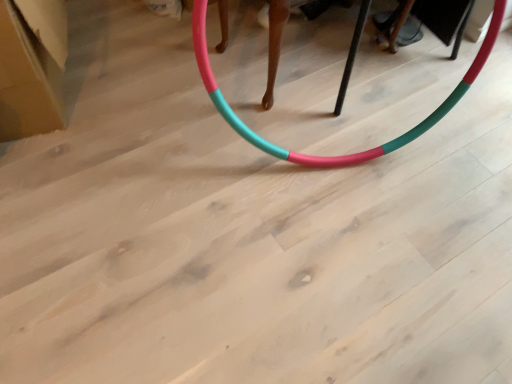
Question: Would you say teal matte hula hoop at center is inside or outside white cardboard box at upper left?

Choices:
 (A) outside
 (B) inside

Answer: (A)

Question: From their relative heights in the image, would you say teal matte hula hoop at center is taller or shorter than white cardboard box at upper left?

Choices:
 (A) tall
 (B) short

Answer: (A)

Question: From a real-world perspective, is teal matte hula hoop at center above or below white cardboard box at upper left?

Choices:
 (A) above
 (B) below

Answer: (A)

Question: In the image, is white cardboard box at upper left positioned in front of or behind teal matte hula hoop at center?

Choices:
 (A) front
 (B) behind

Answer: (B)

Question: Choose the correct answer: Is white cardboard box at upper left inside teal matte hula hoop at center or outside it?

Choices:
 (A) inside
 (B) outside

Answer: (B)

Question: Is white cardboard box at upper left wider or thinner than teal matte hula hoop at center?

Choices:
 (A) wide
 (B) thin

Answer: (A)

Question: From their relative heights in the image, would you say white cardboard box at upper left is taller or shorter than teal matte hula hoop at center?

Choices:
 (A) short
 (B) tall

Answer: (A)